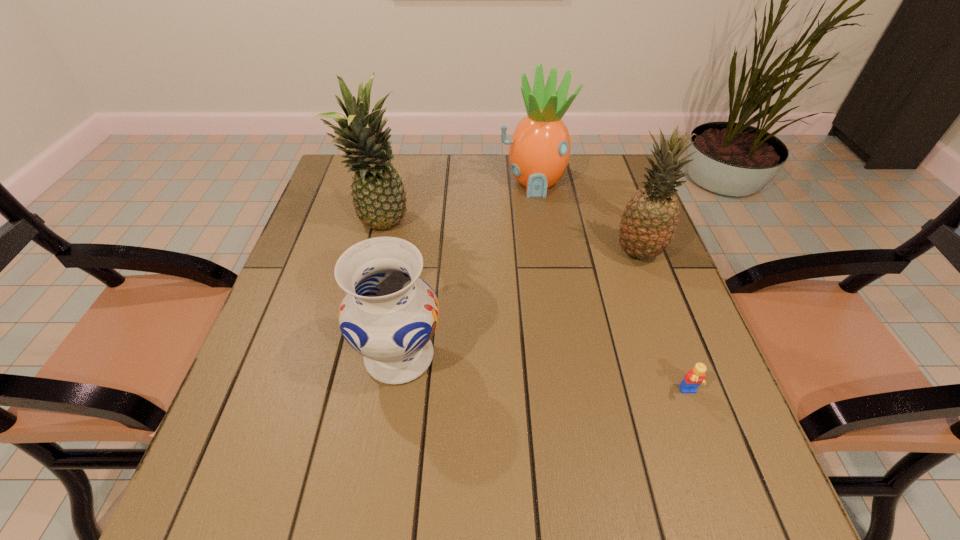
Locate an element on the screen. This screenshot has width=960, height=540. the leftmost pineapple is located at coordinates (379, 198).

I want to click on the rightmost pineapple, so click(650, 218).

What are the coordinates of `the farthest pineapple` in the screenshot? It's located at (539, 151).

Where is `the farthest object`? This screenshot has width=960, height=540. the farthest object is located at coordinates (539, 151).

Where is `vase`? vase is located at coordinates (389, 314).

This screenshot has height=540, width=960. Identify the location of Lego. (695, 377).

Where is `vacant space located 0.390m on the front of the leftmost pineapple`? vacant space located 0.390m on the front of the leftmost pineapple is located at coordinates (342, 381).

Where is `free spot located 0.370m on the back of the rightmost pineapple`? The width and height of the screenshot is (960, 540). free spot located 0.370m on the back of the rightmost pineapple is located at coordinates (605, 161).

Identify the location of vacant space located 0.170m at the entrance of the farthest pineapple. The width and height of the screenshot is (960, 540). point(541,240).

Identify the location of free spot located on the left of the second shortest object. (257, 356).